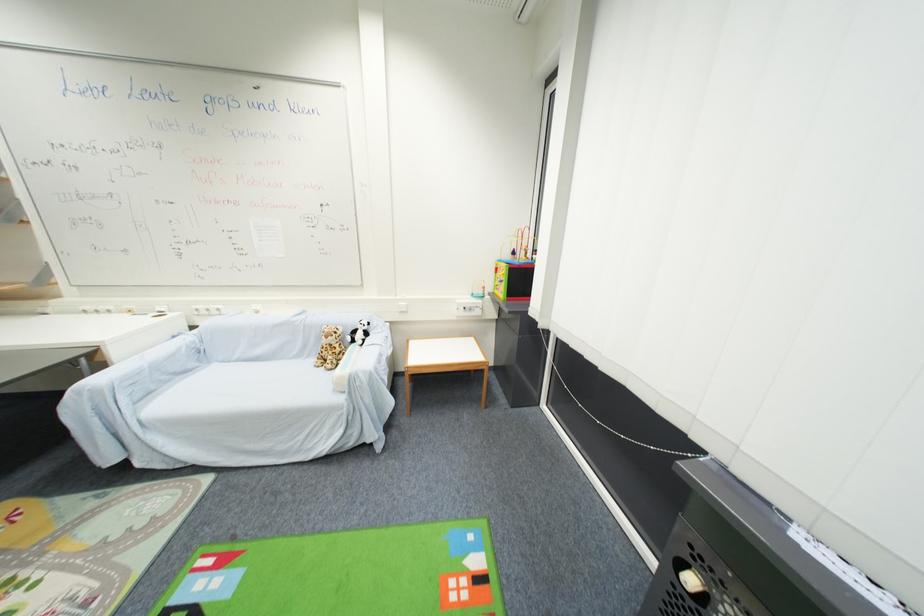
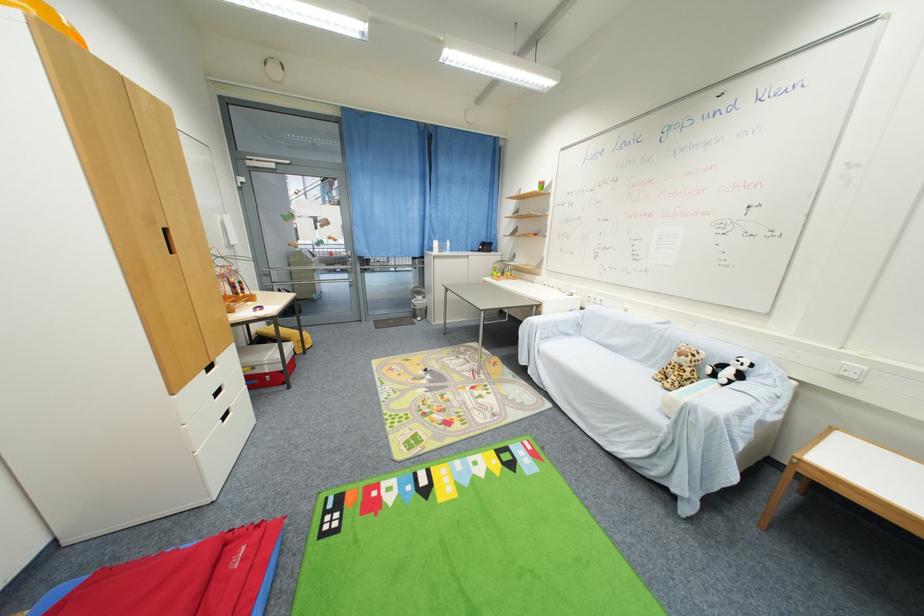
In the second image, find the point that corresponds to the point at 359,333 in the first image.

(727, 368)